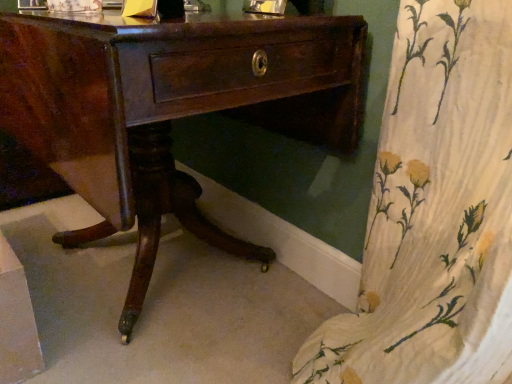
The width and height of the screenshot is (512, 384). Identify the location of vacant area situated below shiny dark wood desk at center (from a real-world perspective). (170, 278).